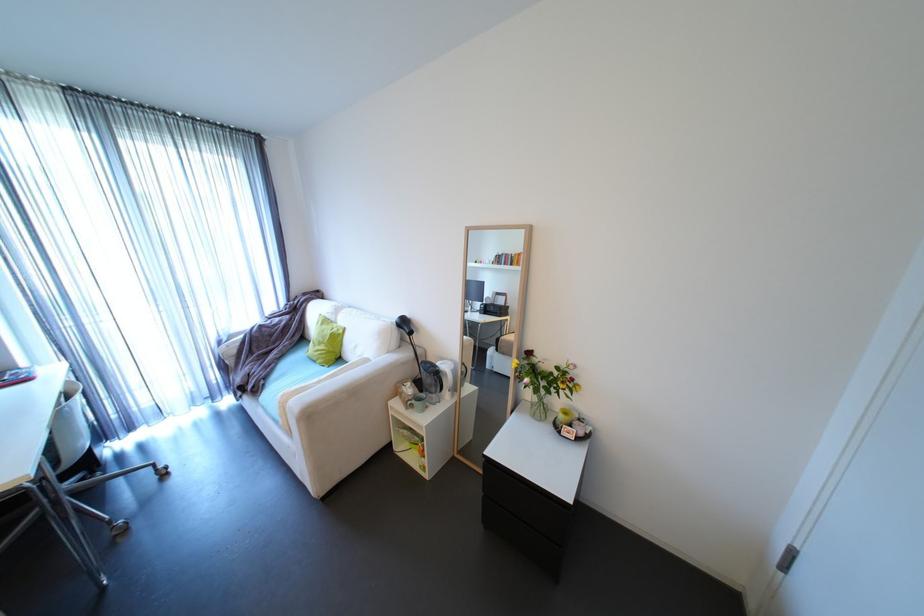
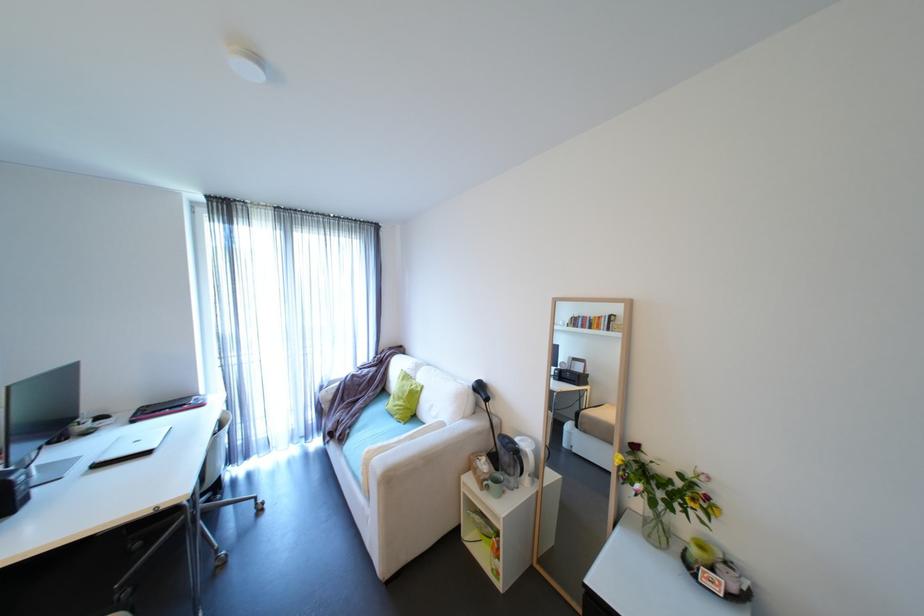
Find the pixel in the second image that matches the point at 418,394 in the first image.

(492, 471)